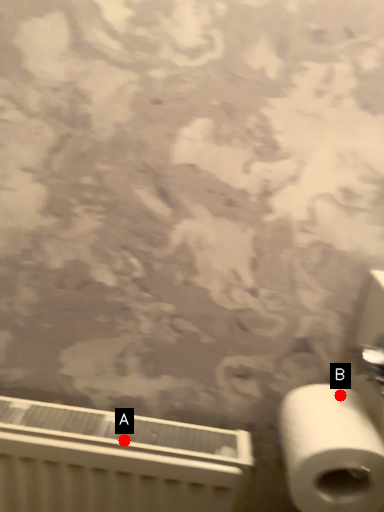
Question: Two points are circled on the image, labeled by A and B beside each circle. Which point is farther from the camera taking this photo?

Choices:
 (A) A is further
 (B) B is further

Answer: (A)